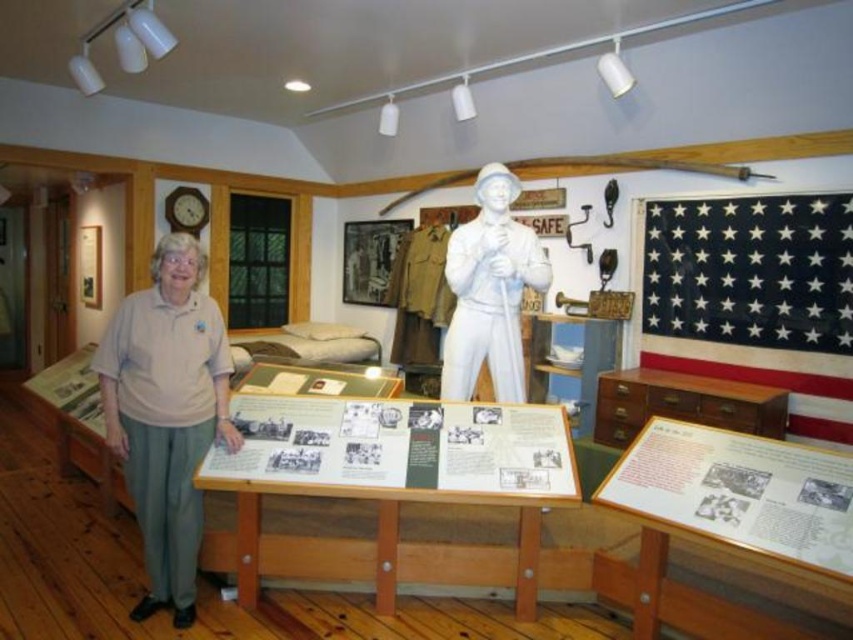
Question: Estimate the real-world distances between objects in this image. Which object is farther from the black cotton flag at upper right?

Choices:
 (A) white glossy statue at center
 (B) white cotton shirt at left

Answer: (B)

Question: Where is black cotton flag at upper right located in relation to white glossy statue at center in the image?

Choices:
 (A) left
 (B) right

Answer: (B)

Question: Which point appears farthest from the camera in this image?

Choices:
 (A) (225, 340)
 (B) (466, 364)

Answer: (B)

Question: Can you confirm if black cotton flag at upper right is positioned below white cotton shirt at left?

Choices:
 (A) no
 (B) yes

Answer: (A)

Question: Does white cotton shirt at left appear over white glossy statue at center?

Choices:
 (A) yes
 (B) no

Answer: (B)

Question: Which point is farther to the camera?

Choices:
 (A) black cotton flag at upper right
 (B) white cotton shirt at left

Answer: (A)